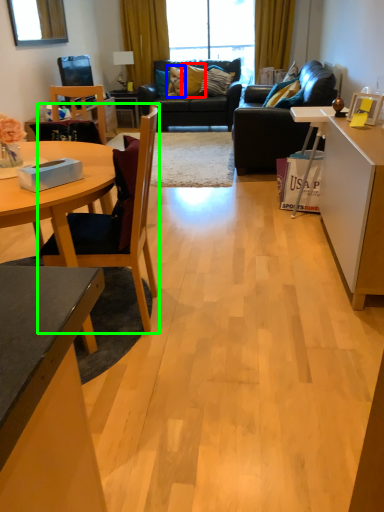
Question: Which object is positioned farthest from pillow (highlighted by a red box)? Select from pillow (highlighted by a blue box) and chair (highlighted by a green box).

Choices:
 (A) pillow
 (B) chair

Answer: (B)